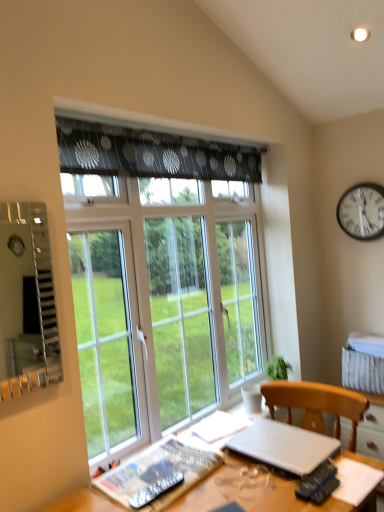
Question: Is the surface of silver metallic laptop at lower right in direct contact with wooden desk at lower center?

Choices:
 (A) no
 (B) yes

Answer: (A)

Question: Does silver metallic laptop at lower right have a smaller size compared to wooden desk at lower center?

Choices:
 (A) no
 (B) yes

Answer: (B)

Question: Does silver metallic laptop at lower right have a greater width compared to wooden desk at lower center?

Choices:
 (A) no
 (B) yes

Answer: (A)

Question: Does silver metallic laptop at lower right have a lesser height compared to wooden desk at lower center?

Choices:
 (A) no
 (B) yes

Answer: (B)

Question: Would you say silver metallic laptop at lower right contains wooden desk at lower center?

Choices:
 (A) yes
 (B) no

Answer: (B)

Question: Is silver metallic laptop at lower right taller than wooden desk at lower center?

Choices:
 (A) no
 (B) yes

Answer: (A)

Question: Is the depth of black metal clock at upper right greater than that of silver metallic laptop at lower right?

Choices:
 (A) no
 (B) yes

Answer: (B)

Question: Are black metal clock at upper right and silver metallic laptop at lower right far apart?

Choices:
 (A) yes
 (B) no

Answer: (A)

Question: Is black metal clock at upper right facing towards silver metallic laptop at lower right?

Choices:
 (A) yes
 (B) no

Answer: (B)

Question: From a real-world perspective, is black metal clock at upper right beneath silver metallic laptop at lower right?

Choices:
 (A) yes
 (B) no

Answer: (B)

Question: From the image's perspective, is black metal clock at upper right on top of silver metallic laptop at lower right?

Choices:
 (A) yes
 (B) no

Answer: (A)

Question: From a real-world perspective, is black metal clock at upper right located higher than silver metallic laptop at lower right?

Choices:
 (A) no
 (B) yes

Answer: (B)

Question: Considering the relative positions of transparent glass window at center and silver metallic laptop at lower right in the image provided, is transparent glass window at center behind silver metallic laptop at lower right?

Choices:
 (A) yes
 (B) no

Answer: (A)